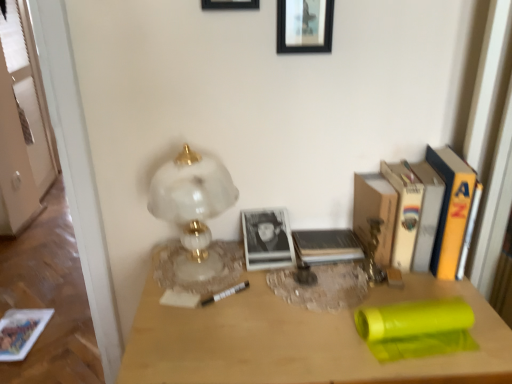
At what (x,y) coordinates should I click in order to perform the action: click on space that is in front of hardcover book at right, the 3th paperback book when ordered from right to left. Please return your answer as a coordinate pair (x, y). Image resolution: width=512 pixels, height=384 pixels. Looking at the image, I should click on (424, 289).